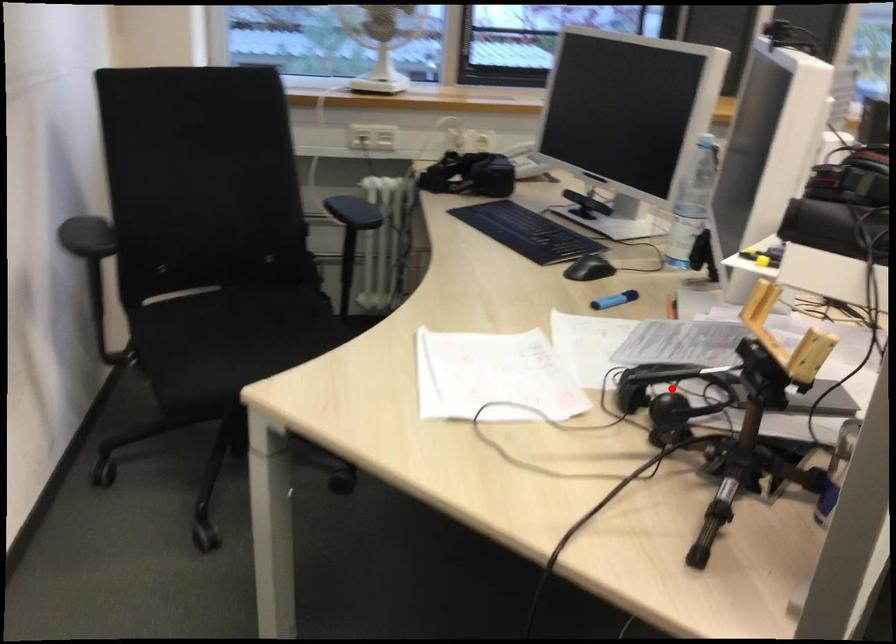
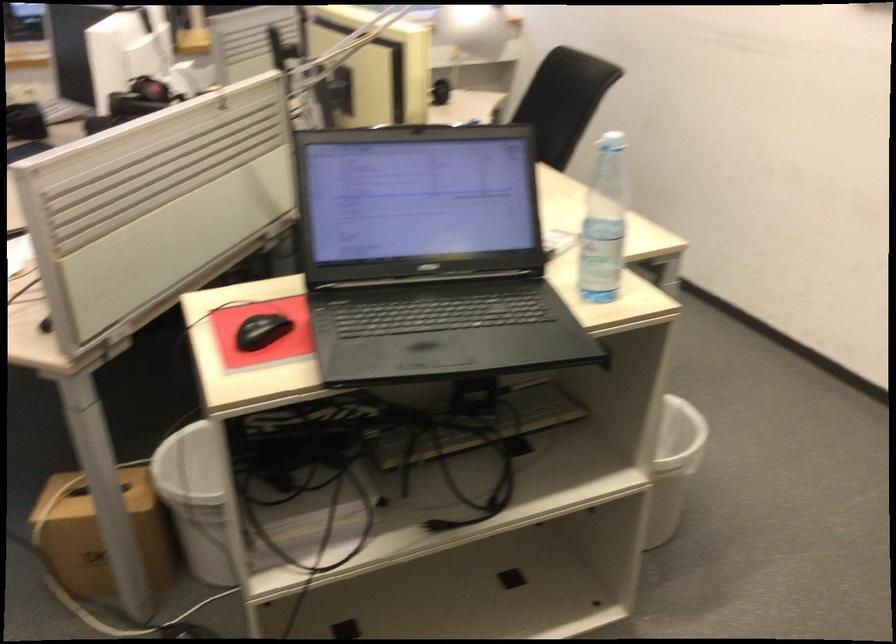
Question: I am providing you with two images of the same scene from different viewpoints. A red point is marked on the first image. Can you still see the location of the red point in image 2?

Choices:
 (A) Yes
 (B) No

Answer: (B)